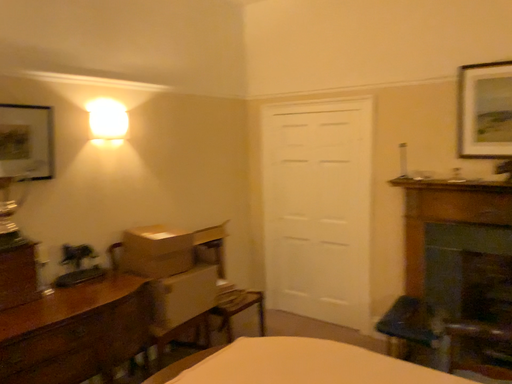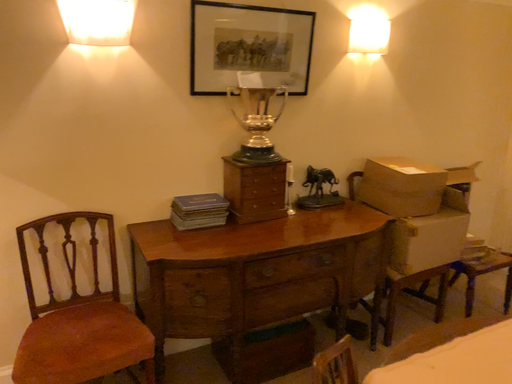
Question: How did the camera likely rotate when shooting the video?

Choices:
 (A) rotated upward
 (B) rotated downward

Answer: (B)